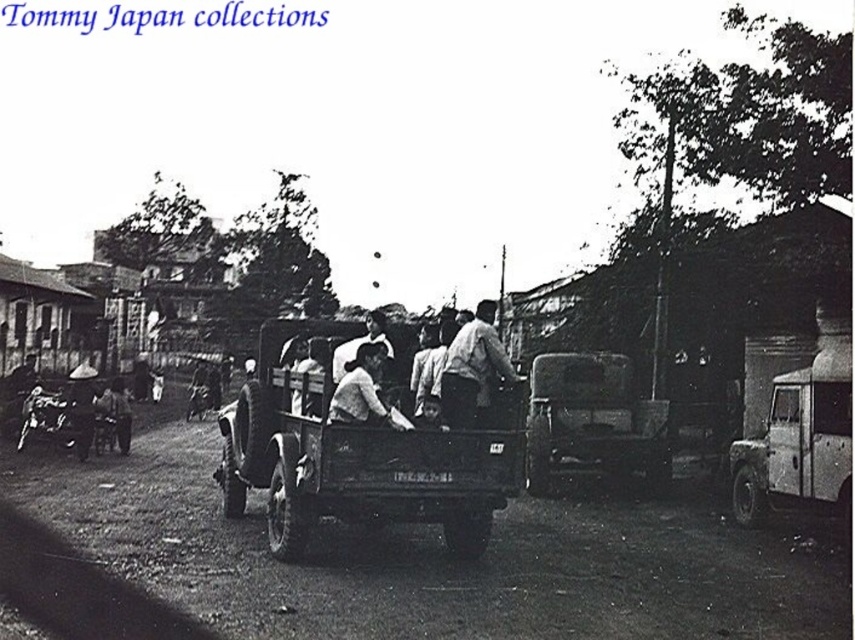
Between metallic silver pickup truck at center and light brown leather jacket at center, which one has more height?

metallic silver pickup truck at center

Based on the photo, does metallic silver pickup truck at center have a larger size compared to light brown leather jacket at center?

Incorrect, metallic silver pickup truck at center is not larger than light brown leather jacket at center.

Is point (828, 307) closer to camera compared to point (486, 326)?

That is False.

You are a GUI agent. You are given a task and a screenshot of the screen. Output one action in this format:
    pyautogui.click(x=<x>, y=<y>)
    Task: Click on the metallic silver pickup truck at center
    
    Given the screenshot: What is the action you would take?
    pyautogui.click(x=800, y=435)

Who is taller, metallic truck bed at center or light brown leather jacket at center?

light brown leather jacket at center

Does metallic truck bed at center appear over light brown leather jacket at center?

Incorrect, metallic truck bed at center is not positioned above light brown leather jacket at center.

Measure the distance between point (x=233, y=458) and camera.

Point (x=233, y=458) is 9.50 meters away from camera.

Find the location of `metallic truck bed at center`. metallic truck bed at center is located at coordinates (358, 456).

What do you see at coordinates (358, 456) in the screenshot?
I see `metallic truck bed at center` at bounding box center [358, 456].

Does metallic truck bed at center come in front of metallic silver pickup truck at center?

Yes, metallic truck bed at center is closer to the viewer.

Between point (234, 410) and point (814, 477), which one is positioned in front?

Point (814, 477) is more forward.

Locate an element on the screen. The image size is (855, 640). metallic truck bed at center is located at coordinates (358, 456).